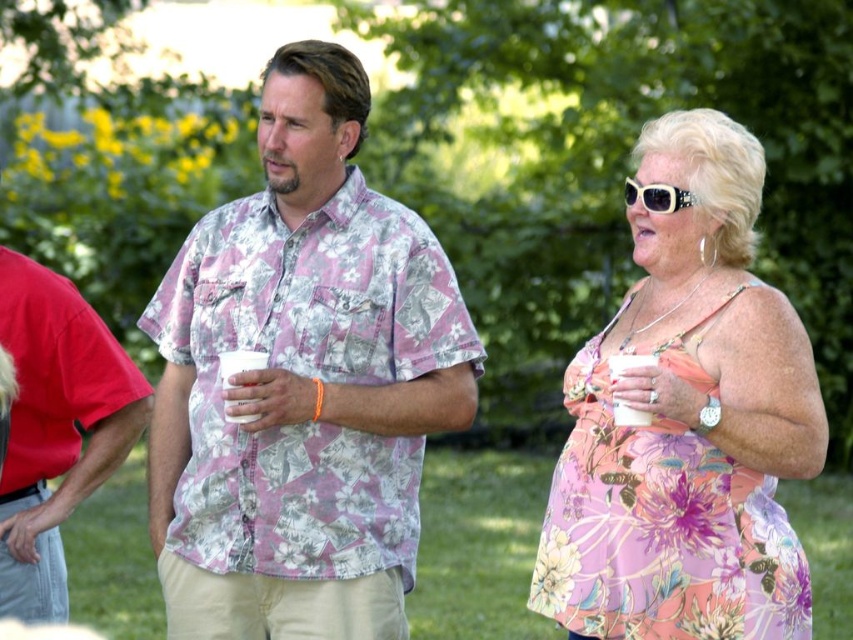
Question: Which point is closer to the camera taking this photo?

Choices:
 (A) pyautogui.click(x=343, y=332)
 (B) pyautogui.click(x=683, y=198)
 (C) pyautogui.click(x=54, y=534)
 (D) pyautogui.click(x=239, y=365)

Answer: (B)

Question: Which point is closer to the camera?

Choices:
 (A) (181, 358)
 (B) (227, 369)

Answer: (B)

Question: Which object appears farthest from the camera in this image?

Choices:
 (A) gold textured sunglasses at upper right
 (B) floral-patterned shirt at center

Answer: (B)

Question: Does floral-patterned shirt at center have a lesser width compared to gold textured sunglasses at upper right?

Choices:
 (A) no
 (B) yes

Answer: (A)

Question: Does floral fabric dress at center have a lesser width compared to gold textured sunglasses at upper right?

Choices:
 (A) yes
 (B) no

Answer: (B)

Question: Is floral-patterned shirt at center above matte red shirt at left?

Choices:
 (A) yes
 (B) no

Answer: (A)